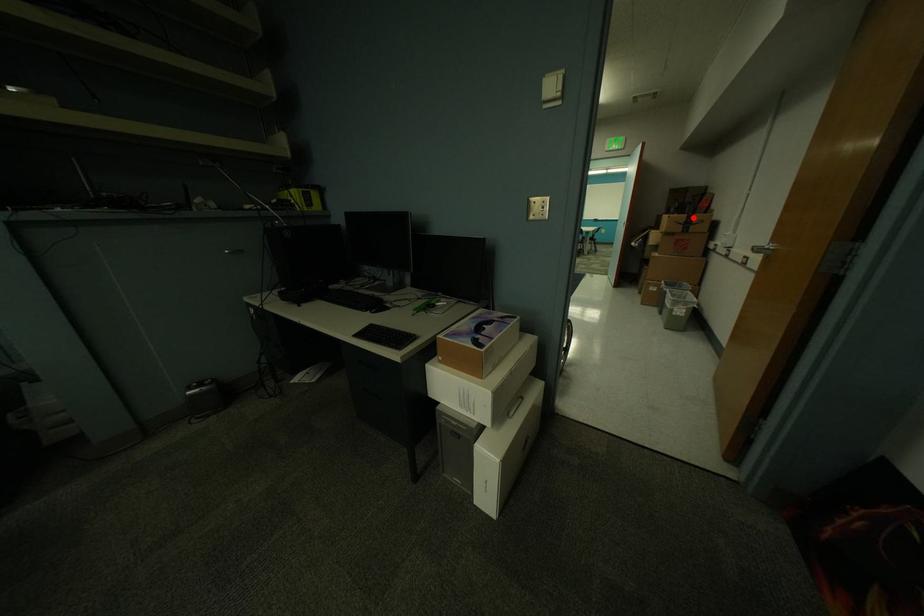
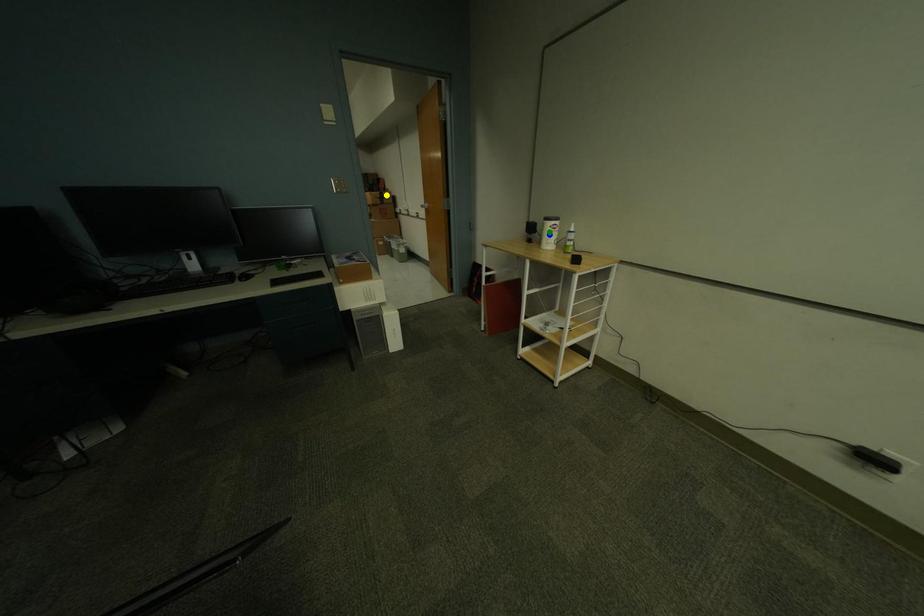
Question: I am providing you with two images of the same scene from different viewpoints. A red point is marked on the first image. You are given multiple points on the second image. In image 2, which mark is for the same physical point as the one in image 1?

Choices:
 (A) blue point
 (B) yellow point
 (C) green point

Answer: (B)